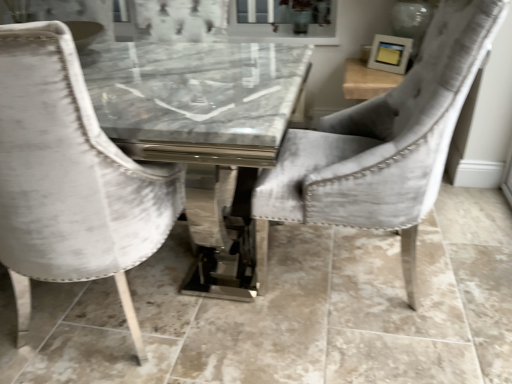
Question: Would you say velvet white chair at left, the second chair positioned from the right, is to the left or to the right of velvet gray chair at center, which is counted as the 1th chair, starting from the right, in the picture?

Choices:
 (A) left
 (B) right

Answer: (A)

Question: Choose the correct answer: Is velvet white chair at left, the second chair positioned from the right, inside velvet gray chair at center, which is counted as the 1th chair, starting from the right, or outside it?

Choices:
 (A) outside
 (B) inside

Answer: (A)

Question: Relative to velvet gray chair at center, the 2th chair positioned from the left, is velvet white chair at left, the second chair positioned from the right, in front or behind?

Choices:
 (A) behind
 (B) front

Answer: (B)

Question: From the image's perspective, relative to velvet white chair at left, the second chair positioned from the right, is velvet gray chair at center, which is counted as the 1th chair, starting from the right, above or below?

Choices:
 (A) above
 (B) below

Answer: (A)

Question: Is velvet gray chair at center, the 2th chair positioned from the left, inside the boundaries of velvet white chair at left, which is the first chair in left-to-right order, or outside?

Choices:
 (A) outside
 (B) inside

Answer: (A)

Question: Considering their positions, is velvet gray chair at center, which is counted as the 1th chair, starting from the right, located in front of or behind velvet white chair at left, the second chair positioned from the right?

Choices:
 (A) front
 (B) behind

Answer: (B)

Question: Looking at their shapes, would you say velvet gray chair at center, the 2th chair positioned from the left, is wider or thinner than velvet white chair at left, the second chair positioned from the right?

Choices:
 (A) wide
 (B) thin

Answer: (A)